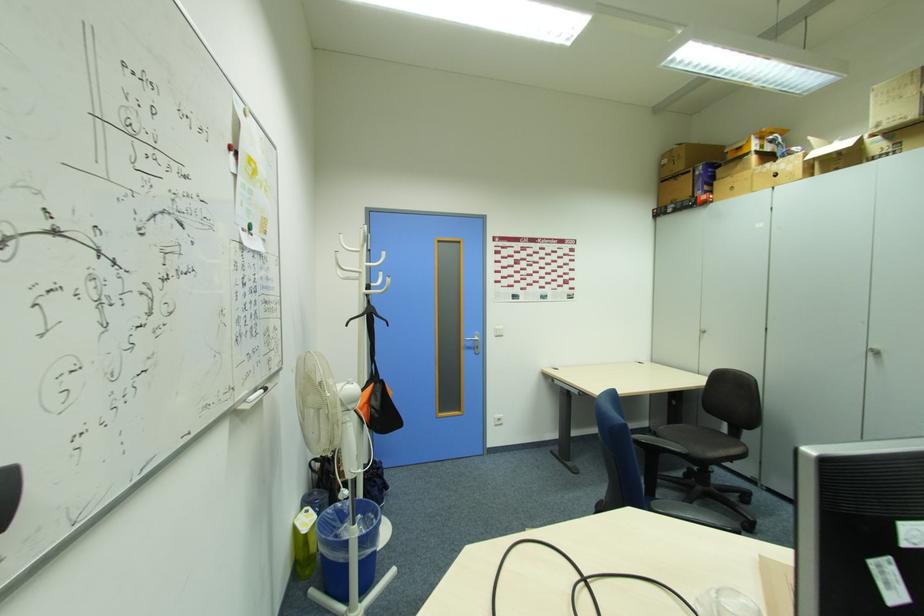
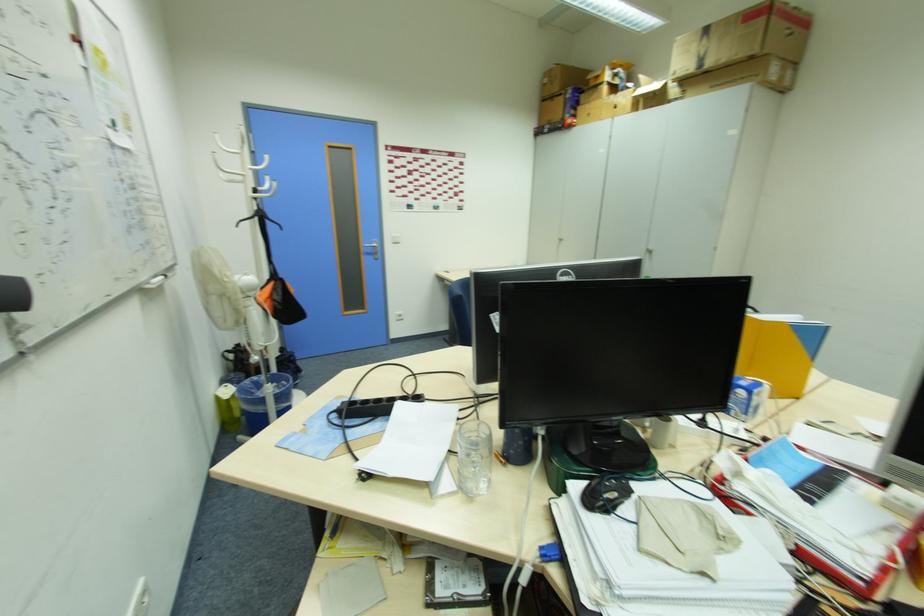
Locate, in the second image, the point that corresponds to (381,416) in the first image.

(283, 309)